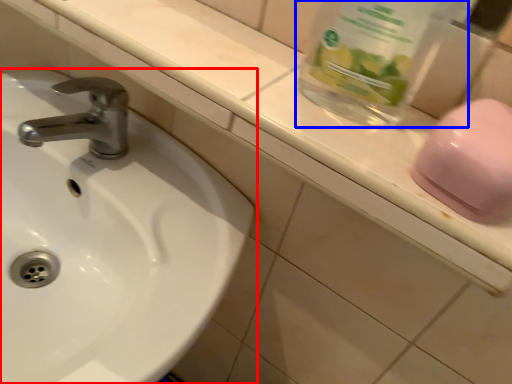
Question: Which point is further to the camera, sink (highlighted by a red box) or glass jar (highlighted by a blue box)?

Choices:
 (A) sink
 (B) glass jar

Answer: (A)